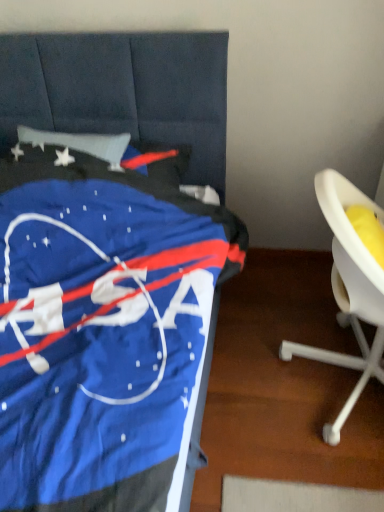
Measure the distance between point (209, 249) and camera.

Point (209, 249) is 3.97 feet from camera.

Describe the element at coordinates (101, 329) in the screenshot. I see `blue fabric nasa bedspread at left` at that location.

At what (x,y) coordinates should I click in order to perform the action: click on blue fabric nasa bedspread at left. Please return your answer as a coordinate pair (x, y). Looking at the image, I should click on (101, 329).

From the picture: Measure the distance between point (330, 434) and camera.

The distance of point (330, 434) from camera is 4.51 feet.

The width and height of the screenshot is (384, 512). Identify the location of white plastic chair at right. (348, 291).

What do you see at coordinates (348, 291) in the screenshot? The height and width of the screenshot is (512, 384). I see `white plastic chair at right` at bounding box center [348, 291].

The width and height of the screenshot is (384, 512). Find the location of `blue fabric nasa bedspread at left`. blue fabric nasa bedspread at left is located at coordinates (101, 329).

Looking at this image, would you say white plastic chair at right is to the left or to the right of blue fabric nasa bedspread at left in the picture?

white plastic chair at right is to the right of blue fabric nasa bedspread at left.

Which object is further away from the camera taking this photo, white plastic chair at right or blue fabric nasa bedspread at left?

Positioned behind is white plastic chair at right.

Between point (381, 286) and point (9, 190), which one is positioned behind?

Point (9, 190)

From the image's perspective, who appears lower, white plastic chair at right or blue fabric nasa bedspread at left?

From the image's view, white plastic chair at right is below.

Based on the photo, from a real-world perspective, which object stands above the other?

In real-world perspective, blue fabric nasa bedspread at left is above.

Does white plastic chair at right have a greater width compared to blue fabric nasa bedspread at left?

No.

In terms of height, does white plastic chair at right look taller or shorter compared to blue fabric nasa bedspread at left?

Considering their sizes, white plastic chair at right has more height than blue fabric nasa bedspread at left.

Does white plastic chair at right have a larger size compared to blue fabric nasa bedspread at left?

Incorrect, white plastic chair at right is not larger than blue fabric nasa bedspread at left.

Is white plastic chair at right completely or partially outside of blue fabric nasa bedspread at left?

Absolutely, white plastic chair at right is external to blue fabric nasa bedspread at left.

In the scene shown: Is white plastic chair at right not close to blue fabric nasa bedspread at left?

No, white plastic chair at right is in close proximity to blue fabric nasa bedspread at left.

Is white plastic chair at right aimed at blue fabric nasa bedspread at left?

No.

How far apart are white plastic chair at right and blue fabric nasa bedspread at left?

white plastic chair at right and blue fabric nasa bedspread at left are 59.94 centimeters apart from each other.

Locate an element on the screen. The image size is (384, 512). chair behind the blue fabric nasa bedspread at left is located at coordinates click(348, 291).

Which is more to the right, blue fabric nasa bedspread at left or white plastic chair at right?

white plastic chair at right.

Does blue fabric nasa bedspread at left lie in front of white plastic chair at right?

Yes, it is in front of white plastic chair at right.

Is point (65, 467) closer to viewer compared to point (345, 305)?

Yes.

From the image's perspective, which one is positioned higher, blue fabric nasa bedspread at left or white plastic chair at right?

From the image's view, blue fabric nasa bedspread at left is above.

From a real-world perspective, is blue fabric nasa bedspread at left physically above white plastic chair at right?

Correct, in the physical world, blue fabric nasa bedspread at left is higher than white plastic chair at right.

Which of these two, blue fabric nasa bedspread at left or white plastic chair at right, is thinner?

white plastic chair at right.

Can you confirm if blue fabric nasa bedspread at left is taller than white plastic chair at right?

In fact, blue fabric nasa bedspread at left may be shorter than white plastic chair at right.

Is blue fabric nasa bedspread at left bigger or smaller than white plastic chair at right?

Considering their sizes, blue fabric nasa bedspread at left takes up more space than white plastic chair at right.

Is white plastic chair at right a part of blue fabric nasa bedspread at left?

Definitely not — white plastic chair at right is not inside blue fabric nasa bedspread at left.

Are blue fabric nasa bedspread at left and white plastic chair at right far apart?

No.

Does blue fabric nasa bedspread at left turn towards white plastic chair at right?

No.

How much distance is there between blue fabric nasa bedspread at left and white plastic chair at right?

They are 23.60 inches apart.

I want to click on furniture that is above the white plastic chair at right (from a real-world perspective), so click(x=101, y=329).

What are the coordinates of `chair that is under the blue fabric nasa bedspread at left (from a real-world perspective)` in the screenshot? It's located at (348, 291).

You are a GUI agent. You are given a task and a screenshot of the screen. Output one action in this format:
    pyautogui.click(x=<x>, y=<y>)
    Task: Click on the chair that is on the right side of blue fabric nasa bedspread at left
    This screenshot has width=384, height=512.
    Given the screenshot: What is the action you would take?
    pyautogui.click(x=348, y=291)